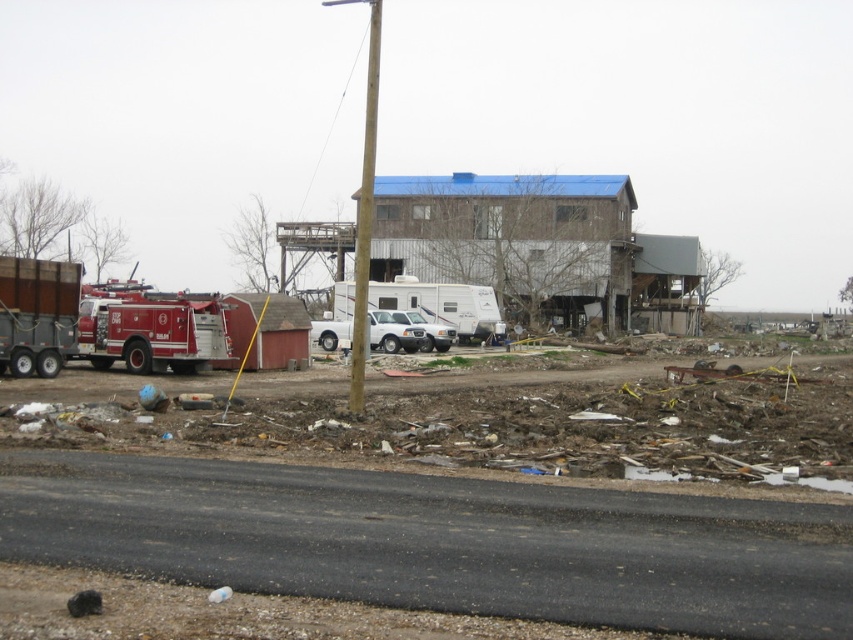
You are standing at the center of the road and see two points marked in the scene. Which point is closer to you, the point at coordinates point (373,68) or the point at coordinates point (392,333)?

Point (373,68) is closer to you because it is further to the viewer than point (392,333).

You are a city planner assessing the damage. You need to determine if the shiny red fire truck at left can pass through a narrow alley that is only as wide as the brown wooden pole at center. Can it fit?

The shiny red fire truck at left is wider than the brown wooden pole at center, so it cannot fit through the alley that is as wide as the brown wooden pole at center.

You are a city planner assessing the damage after a storm. You see the shiny red fire truck at left and the matte brown trailer truck at left in the scene. Which vehicle is larger in size?

The shiny red fire truck at left is bigger than the matte brown trailer truck at left according to the description.